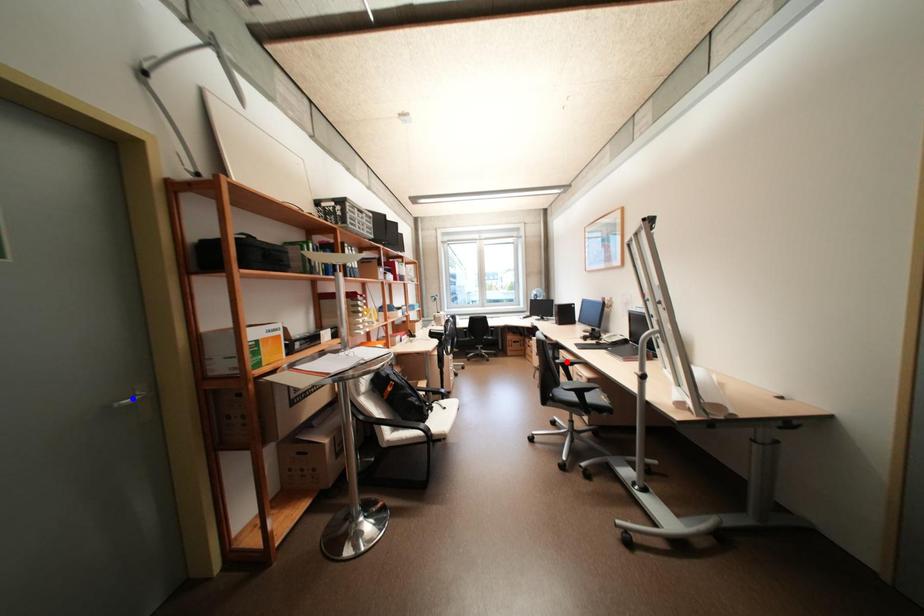
Question: Two points are marked on the image. Which point is closer to the camera?

Choices:
 (A) Blue point is closer.
 (B) Red point is closer.

Answer: (A)